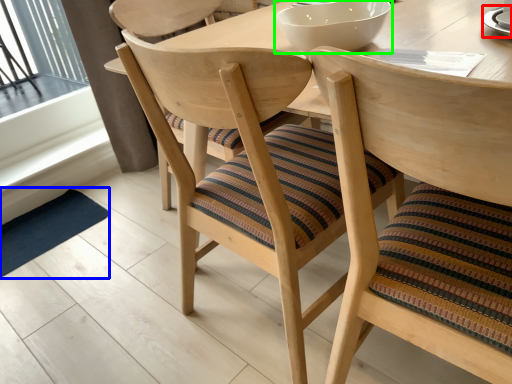
Question: Which object is the farthest from saucer (highlighted by a red box)? Choose among these: mat (highlighted by a blue box) or bowl (highlighted by a green box).

Choices:
 (A) mat
 (B) bowl

Answer: (A)